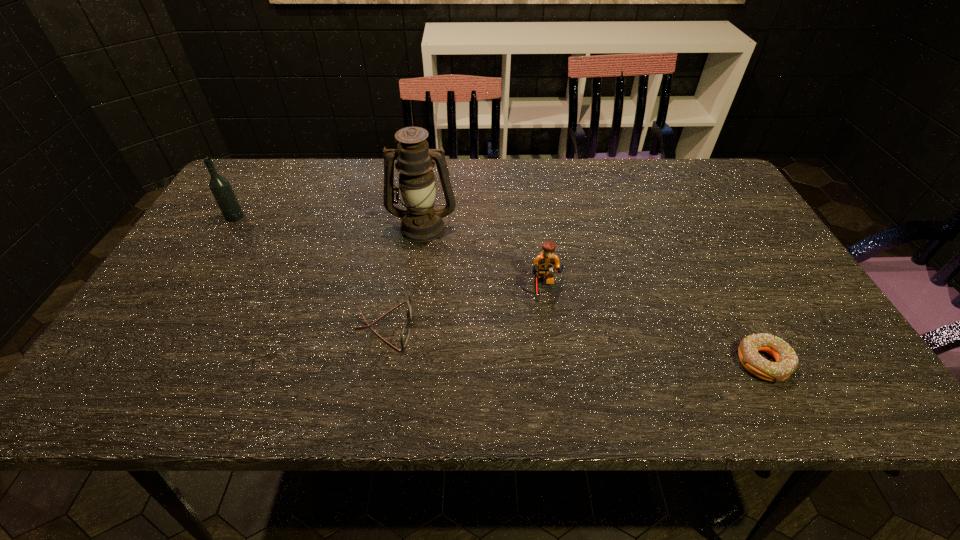
Where is `free space that is in between the vodka and the spectacles`? free space that is in between the vodka and the spectacles is located at coordinates (310, 272).

Identify the location of object that stands as the fourth closest to the tallest object. The height and width of the screenshot is (540, 960). (786, 363).

Locate an element on the screen. object that is the third closest to the leftmost object is located at coordinates (545, 263).

Find the location of a particular element. vacant space that satisfies the following two spatial constraints: 1. on the front side of the doughnut; 2. on the left side of the oil lamp is located at coordinates (403, 363).

Locate an element on the screen. Image resolution: width=960 pixels, height=540 pixels. vacant space that satisfies the following two spatial constraints: 1. holding a crossbow in the hands of the third tallest object; 2. on the front-facing side of the spectacles is located at coordinates (546, 326).

Locate an element on the screen. vacant space that satisfies the following two spatial constraints: 1. on the front side of the oil lamp; 2. on the front-facing side of the spectacles is located at coordinates (409, 326).